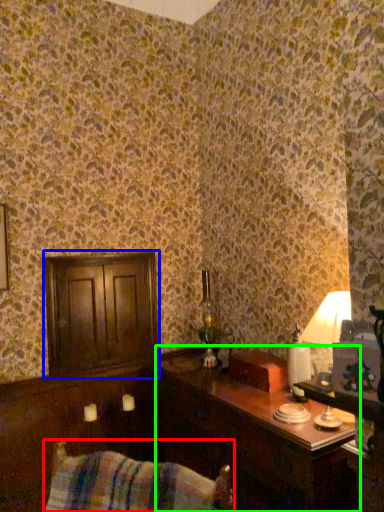
Question: Which object is positioned farthest from swivel chair (highlighted by a red box)? Select from dresser (highlighted by a blue box) and table (highlighted by a green box).

Choices:
 (A) dresser
 (B) table

Answer: (A)